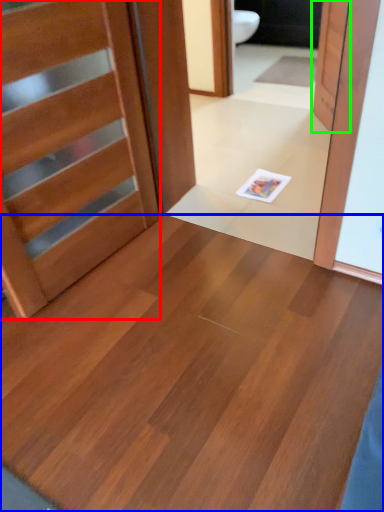
Question: Estimate the real-world distances between objects in this image. Which object is farther from door (highlighted by a red box), plywood (highlighted by a blue box) or door (highlighted by a green box)?

Choices:
 (A) plywood
 (B) door

Answer: (B)